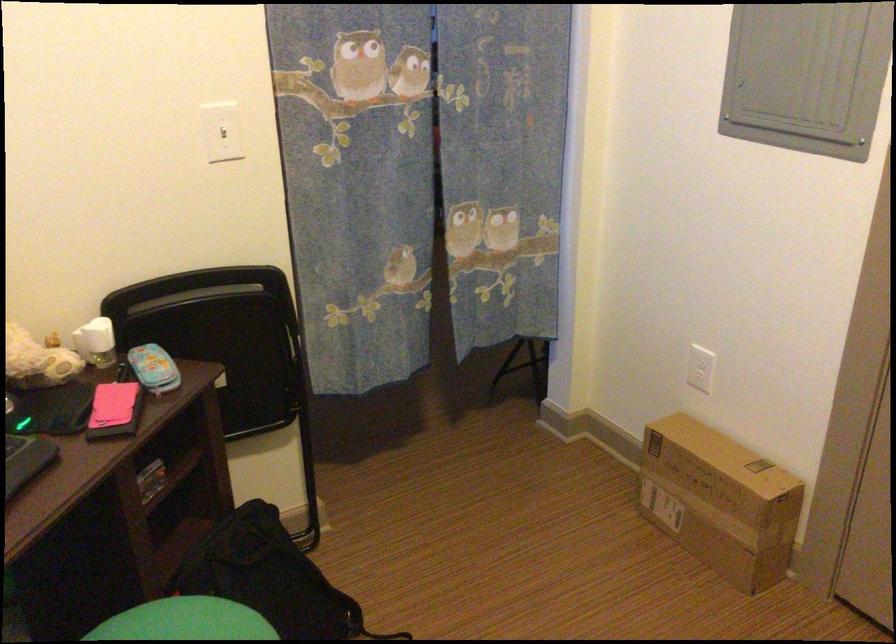
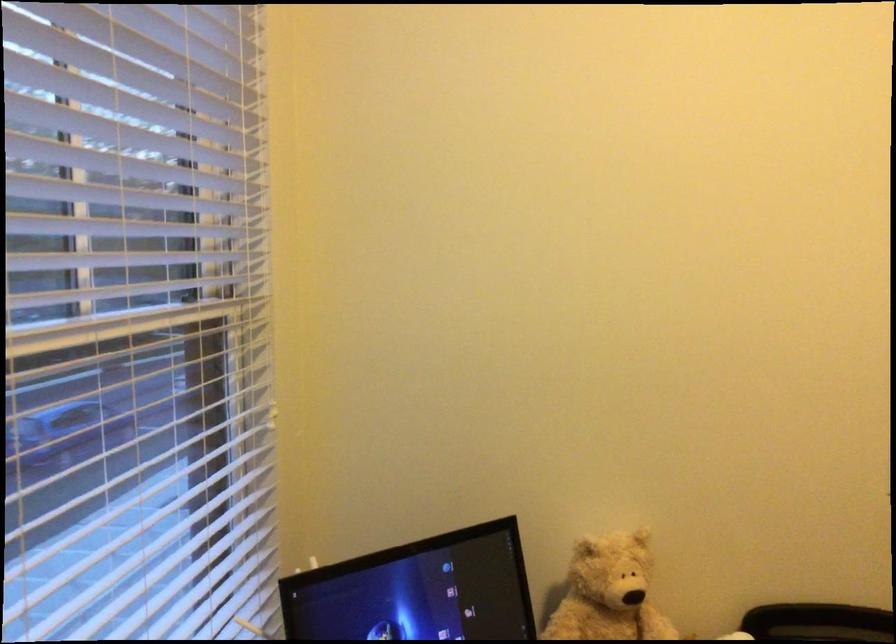
Question: The camera is either moving clockwise (left) or counter-clockwise (right) around the object. The first image is from the beginning of the video and the second image is from the end. Is the camera moving left or right when shooting the video?

Choices:
 (A) Left
 (B) Right

Answer: (B)